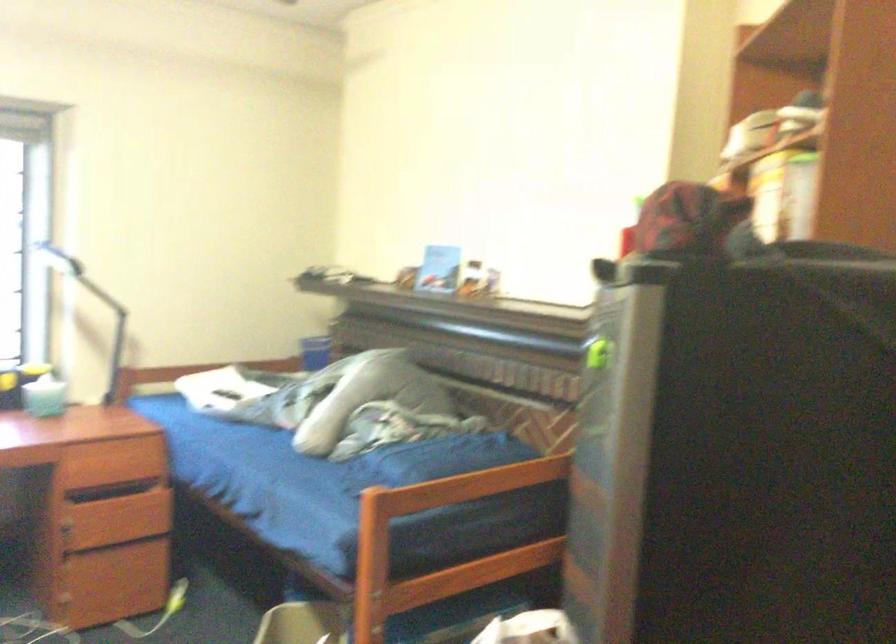
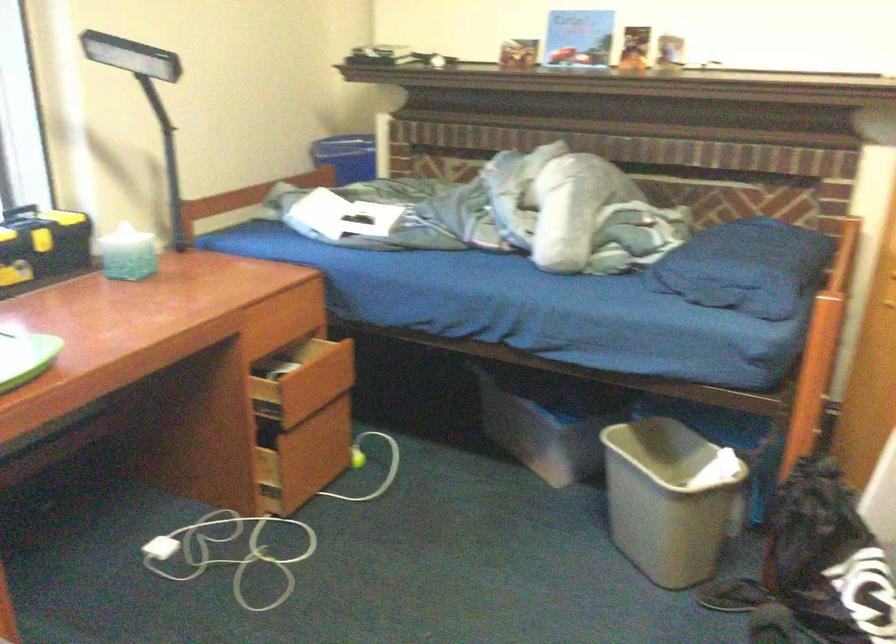
The images are taken continuously from a first-person perspective. In which direction are you moving?

The movement direction of the cameraman is left, forward.